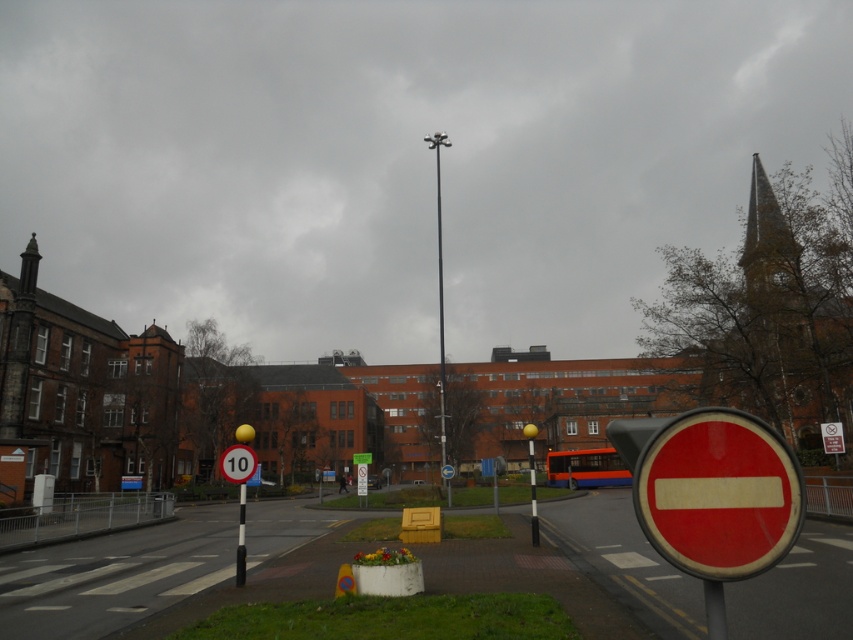
Who is taller, orange metallic bus at center or metallic speed limit sign at left?

With more height is metallic speed limit sign at left.

Can you confirm if orange metallic bus at center is positioned to the right of metallic speed limit sign at left?

Correct, you'll find orange metallic bus at center to the right of metallic speed limit sign at left.

Which is in front, point (585, 456) or point (244, 483)?

Point (244, 483) is in front.

Find the location of a particular element. The height and width of the screenshot is (640, 853). orange metallic bus at center is located at coordinates (587, 468).

What do you see at coordinates (440, 289) in the screenshot?
I see `metallic pole at center` at bounding box center [440, 289].

Who is shorter, metallic pole at center or metallic speed limit sign at left?

With less height is metallic speed limit sign at left.

Where is `metallic pole at center`? This screenshot has width=853, height=640. metallic pole at center is located at coordinates (440, 289).

The image size is (853, 640). I want to click on metallic pole at center, so click(x=440, y=289).

Who is positioned more to the left, metallic speed limit sign at left or black metal pole at center?

Positioned to the left is metallic speed limit sign at left.

From the picture: Which is more to the right, metallic speed limit sign at left or black metal pole at center?

From the viewer's perspective, black metal pole at center appears more on the right side.

This screenshot has width=853, height=640. Find the location of `metallic speed limit sign at left`. metallic speed limit sign at left is located at coordinates (236, 464).